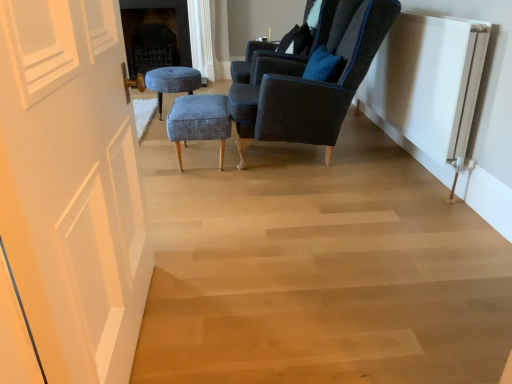
This screenshot has width=512, height=384. I want to click on vacant region below white ribbed radiator at right (from a real-world perspective), so click(416, 173).